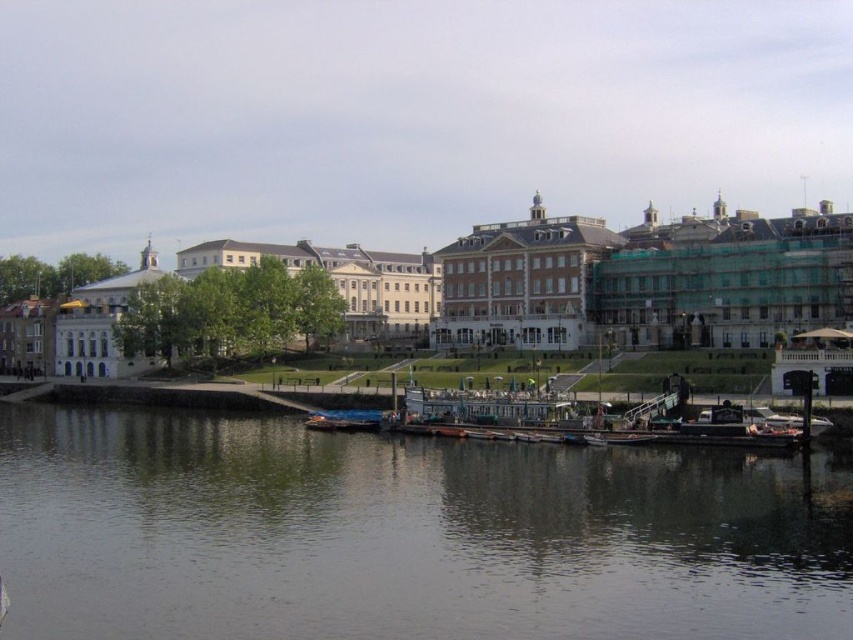
Question: Does dark gray water at lower center appear over blue metallic boat at lower center?

Choices:
 (A) yes
 (B) no

Answer: (B)

Question: Which object appears closest to the camera in this image?

Choices:
 (A) blue metallic boat at lower center
 (B) dark gray water at lower center

Answer: (B)

Question: Among these objects, which one is nearest to the camera?

Choices:
 (A) dark gray water at lower center
 (B) blue metallic boat at lower center

Answer: (A)

Question: Is dark gray water at lower center smaller than blue metallic boat at lower center?

Choices:
 (A) no
 (B) yes

Answer: (A)

Question: Is dark gray water at lower center bigger than blue metallic boat at lower center?

Choices:
 (A) yes
 (B) no

Answer: (A)